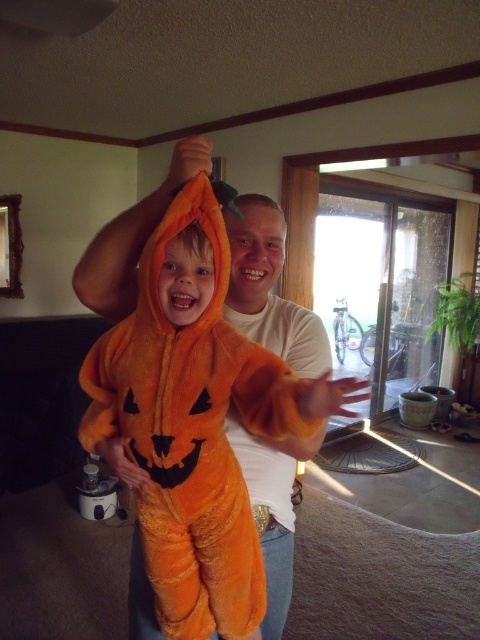
You are a child who wants to choose a pumpkin to carry home. You see a velvety orange pumpkin at center and a matte orange pumpkin at center. Which pumpkin is wider?

The velvety orange pumpkin at center is wider than the matte orange pumpkin at center.

You are a costume designer trying to decide whether to add a decorative ribbon between the white cotton shirt at center and the matte orange pumpkin at center. Based on their widths, will the ribbon fit horizontally between them without overlapping either?

The white cotton shirt at center is wider than the matte orange pumpkin at center. Since the ribbon needs to fit between them horizontally, the difference in their widths means the ribbon can be placed without overlapping, as there is sufficient space between their edges.

You are taking a photo of the scene. You want to focus on the point closer to the camera between the two points labeled as point (252, 218) and point (245, 262). Which point should you focus on?

You should focus on point (252, 218) because it is further to the camera than point (245, 262).